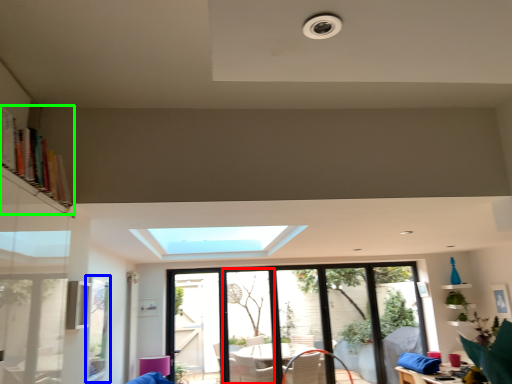
Question: Estimate the real-world distances between objects in this image. Which object is closer to screen door (highlighted by a red box), window screen (highlighted by a blue box) or bookshelf (highlighted by a green box)?

Choices:
 (A) window screen
 (B) bookshelf

Answer: (A)